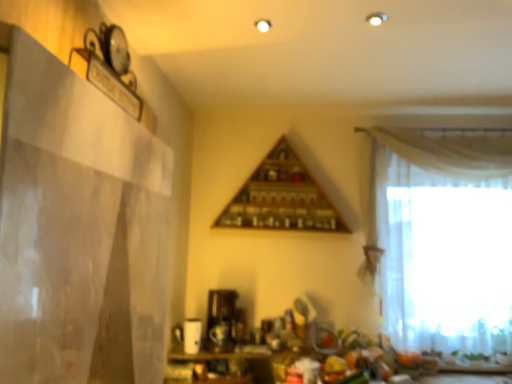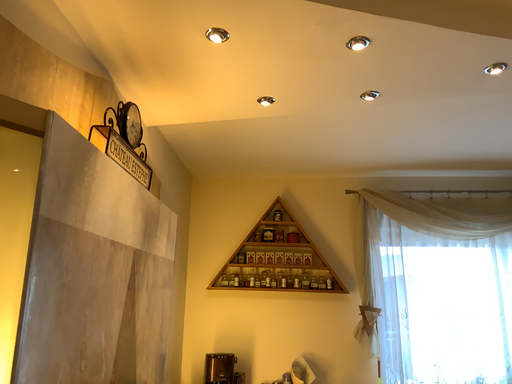
Question: How did the camera likely rotate when shooting the video?

Choices:
 (A) rotated upward
 (B) rotated downward

Answer: (A)